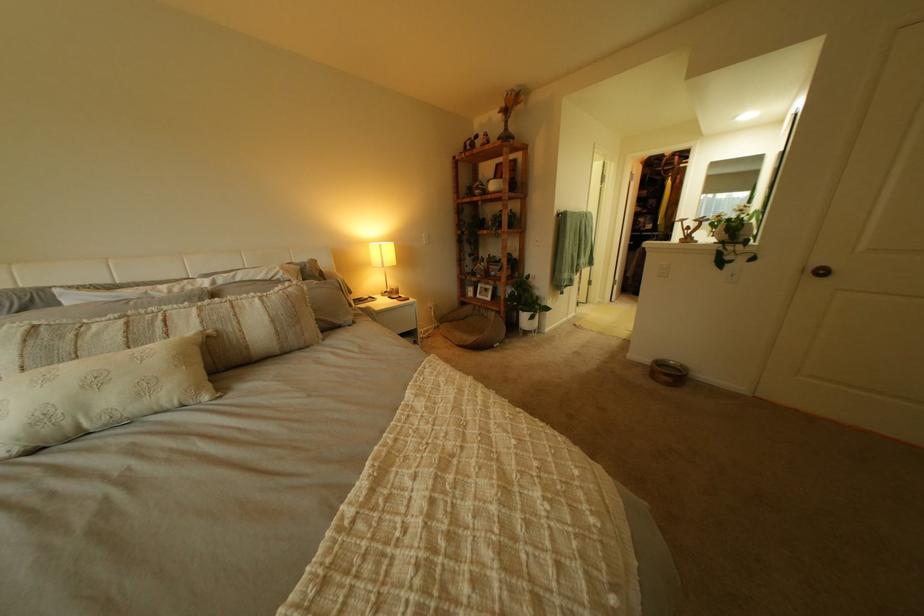
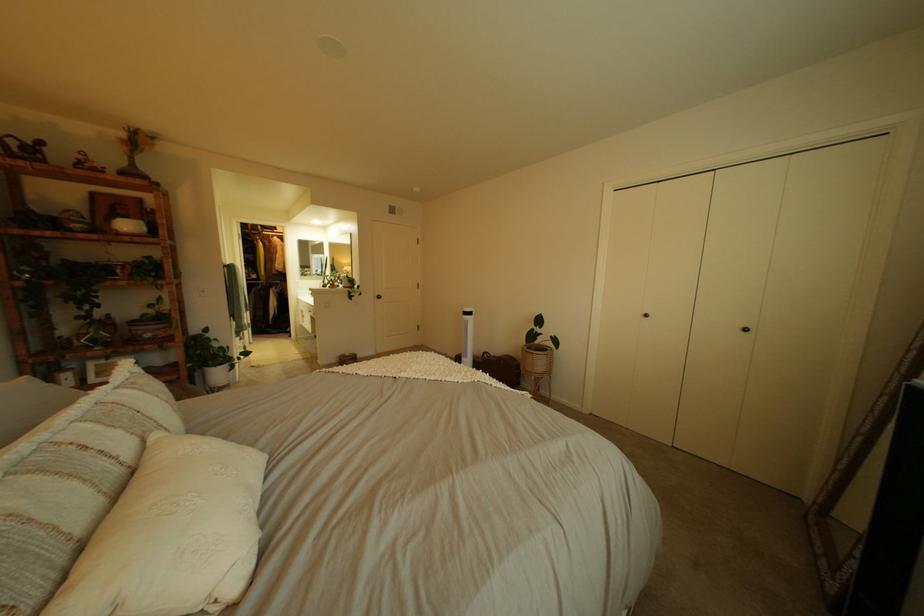
The point at (518, 105) is marked in the first image. Where is the corresponding point in the second image?

(139, 137)